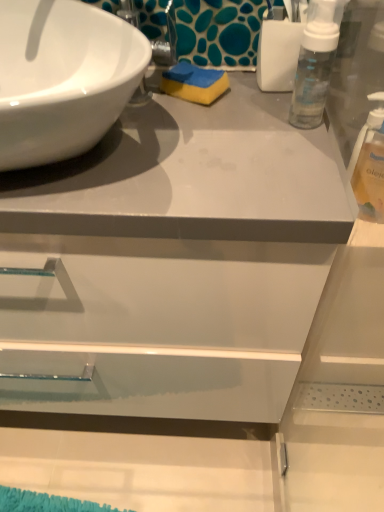
Question: Is blue/yellow sponge at center aimed at white glossy sink at upper left?

Choices:
 (A) no
 (B) yes

Answer: (A)

Question: From the image's perspective, is blue/yellow sponge at center below white glossy sink at upper left?

Choices:
 (A) yes
 (B) no

Answer: (B)

Question: Is white glossy sink at upper left completely or partially inside blue/yellow sponge at center?

Choices:
 (A) no
 (B) yes

Answer: (A)

Question: From a real-world perspective, does blue/yellow sponge at center stand above white glossy sink at upper left?

Choices:
 (A) no
 (B) yes

Answer: (A)

Question: Does blue/yellow sponge at center have a greater height compared to white glossy sink at upper left?

Choices:
 (A) no
 (B) yes

Answer: (A)

Question: From a real-world perspective, is blue/yellow sponge at center located beneath white glossy sink at upper left?

Choices:
 (A) no
 (B) yes

Answer: (B)

Question: Is clear plastic bottle at right not close to blue/yellow sponge at center?

Choices:
 (A) yes
 (B) no

Answer: (B)

Question: From the image's perspective, would you say clear plastic bottle at right is shown under blue/yellow sponge at center?

Choices:
 (A) no
 (B) yes

Answer: (B)

Question: Is clear plastic bottle at right not inside blue/yellow sponge at center?

Choices:
 (A) no
 (B) yes

Answer: (B)

Question: Is clear plastic bottle at right placed right next to blue/yellow sponge at center?

Choices:
 (A) yes
 (B) no

Answer: (B)

Question: Would you say blue/yellow sponge at center is part of clear plastic bottle at right's contents?

Choices:
 (A) yes
 (B) no

Answer: (B)

Question: Considering the relative sizes of clear plastic bottle at right and blue/yellow sponge at center in the image provided, is clear plastic bottle at right smaller than blue/yellow sponge at center?

Choices:
 (A) no
 (B) yes

Answer: (A)

Question: Does white glossy sink at upper left touch blue/yellow sponge at center?

Choices:
 (A) yes
 (B) no

Answer: (B)